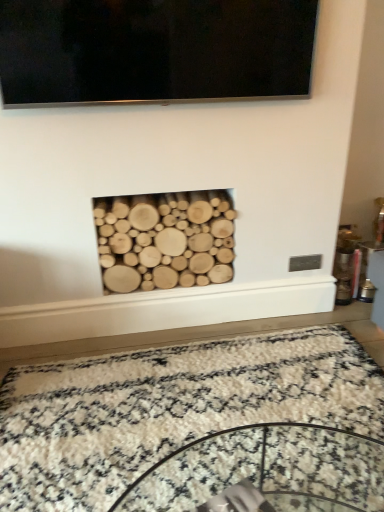
Identify the location of free space above natural wood logs at center (from a real-world perspective). (164, 196).